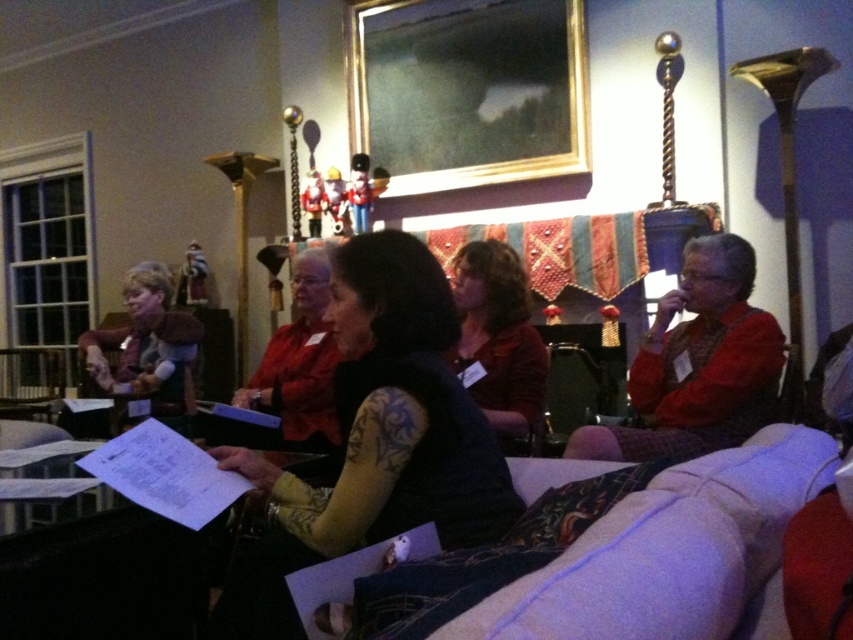
Is gold/gilded picture frame at upper center taller than matte brown vest at left?

Indeed, gold/gilded picture frame at upper center has a greater height compared to matte brown vest at left.

Can you confirm if gold/gilded picture frame at upper center is positioned below matte brown vest at left?

No, gold/gilded picture frame at upper center is not below matte brown vest at left.

Identify the location of gold/gilded picture frame at upper center. (469, 90).

Locate an element on the screen. gold/gilded picture frame at upper center is located at coordinates (469, 90).

Between dark blue fabric at center and gold/gilded picture frame at upper center, which one appears on the left side from the viewer's perspective?

dark blue fabric at center

Is dark blue fabric at center taller than gold/gilded picture frame at upper center?

No.

Does point (399, 259) come farther from viewer compared to point (437, 38)?

No.

Identify the location of dark blue fabric at center. coord(374,440).

Does point (509, 177) lie in front of point (490, 349)?

No, it is not.

Measure the distance between gold/gilded picture frame at upper center and camera.

gold/gilded picture frame at upper center is 3.41 meters from camera.

At what (x,y) coordinates should I click in order to perform the action: click on gold/gilded picture frame at upper center. Please return your answer as a coordinate pair (x, y). This screenshot has width=853, height=640. Looking at the image, I should click on (469, 90).